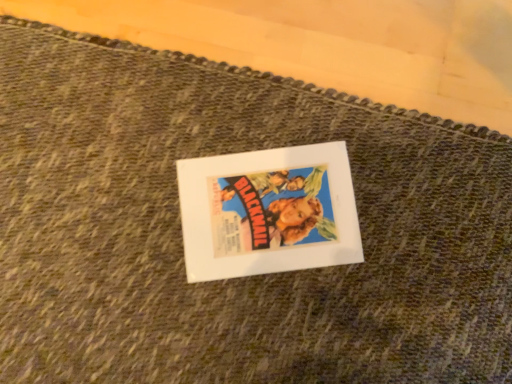
I want to click on vacant area that is situated to the right of white paper at center, so click(x=416, y=210).